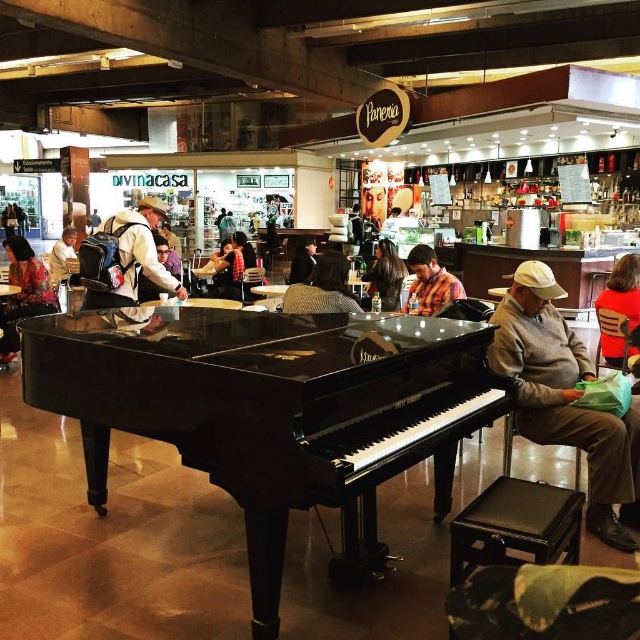
Between white backpack at center and light brown leather jacket at left, which one is positioned higher?

light brown leather jacket at left

Is white backpack at center thinner than light brown leather jacket at left?

Yes.

Which is in front, point (161, 275) or point (61, 248)?

Positioned in front is point (161, 275).

I want to click on white backpack at center, so click(x=134, y=253).

Is gray wool sweater at right wider than striped fabric jacket at center?

Yes, gray wool sweater at right is wider than striped fabric jacket at center.

Is point (588, 484) positioned behind point (336, 307)?

No, (588, 484) is in front of (336, 307).

Who is more forward, (502, 340) or (346, 284)?

Point (502, 340)

Locate an element on the screen. The width and height of the screenshot is (640, 640). gray wool sweater at right is located at coordinates (564, 400).

Is black leather stool at lower center shorter than plaid shirt at center?

Yes, black leather stool at lower center is shorter than plaid shirt at center.

Can you confirm if black leather stool at lower center is wider than plaid shirt at center?

Yes.

Is point (481, 561) closer to camera compared to point (419, 260)?

Yes, it is in front of point (419, 260).

Where is `black leather stool at lower center`? Image resolution: width=640 pixels, height=640 pixels. black leather stool at lower center is located at coordinates (515, 525).